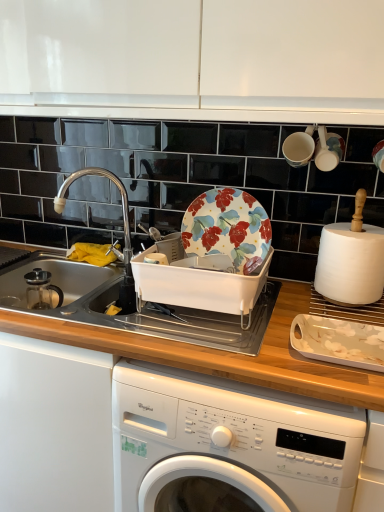
Question: Relative to white glossy platter at lower right, is white glossy cabinet at upper center in front or behind?

Choices:
 (A) behind
 (B) front

Answer: (B)

Question: Considering the positions of white glossy cabinet at upper center and white glossy platter at lower right in the image, is white glossy cabinet at upper center taller or shorter than white glossy platter at lower right?

Choices:
 (A) tall
 (B) short

Answer: (A)

Question: Estimate the real-world distances between objects in this image. Which object is closer to the white glossy platter at lower right?

Choices:
 (A) white matte paper towel at right
 (B) white glossy washing machine at lower center
 (C) white matte cup at upper right, the 2th tableware from the left
 (D) white glossy cabinet at upper center
 (E) white glossy cup at upper right, the second tableware from the right

Answer: (A)

Question: Which of these objects is positioned closest to the white matte paper towel at right?

Choices:
 (A) white glossy cabinet at upper center
 (B) floral ceramic plate at center
 (C) white glossy cup at upper right, the second tableware from the right
 (D) white matte cup at upper right, the 2th tableware from the left
 (E) polished stainless steel faucet at left

Answer: (B)